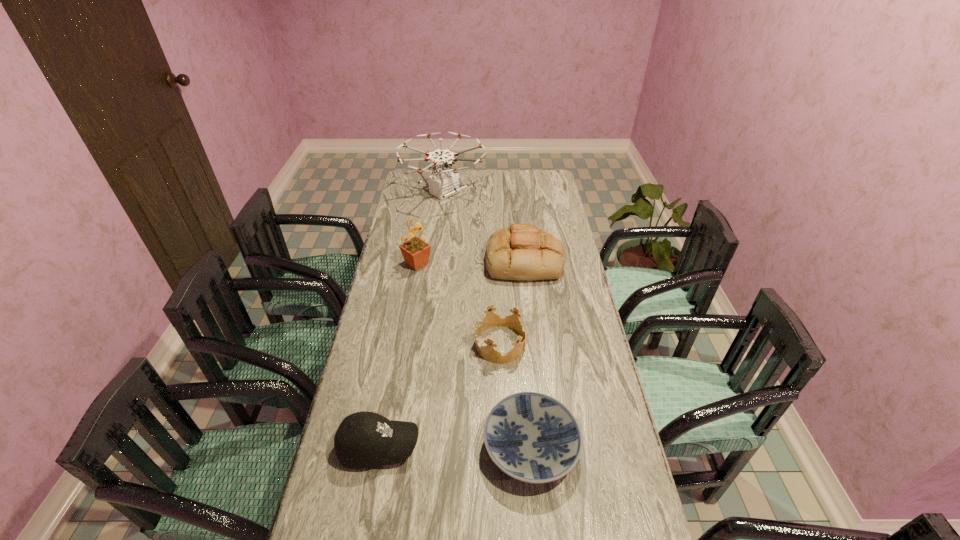
The height and width of the screenshot is (540, 960). What are the coordinates of `vacant region located 0.170m on the front-facing side of the baseball cap` in the screenshot? It's located at (483, 447).

Image resolution: width=960 pixels, height=540 pixels. Find the location of `free region located 0.380m on the front-facing side of the third nearest object`. free region located 0.380m on the front-facing side of the third nearest object is located at coordinates (362, 344).

Find the location of a particular element. This screenshot has height=540, width=960. free spot located on the front-facing side of the third nearest object is located at coordinates (430, 344).

Find the location of a particular element. Image resolution: width=960 pixels, height=540 pixels. free space located 0.260m on the front-facing side of the third nearest object is located at coordinates (397, 344).

Identify the location of free space located 0.360m on the left of the shortest object. (351, 447).

The image size is (960, 540). Find the location of `object present at the far edge`. object present at the far edge is located at coordinates (444, 182).

The width and height of the screenshot is (960, 540). Find the location of `drone that is at the left edge`. drone that is at the left edge is located at coordinates (444, 182).

Locate an element on the screen. This screenshot has height=540, width=960. sunflower located in the left edge section of the desktop is located at coordinates (415, 251).

At what (x,y) coordinates should I click in order to perform the action: click on baseball cap present at the left edge. Please return your answer as a coordinate pair (x, y). This screenshot has width=960, height=540. Looking at the image, I should click on (363, 439).

Identify the location of bread that is positioned at the right edge. The width and height of the screenshot is (960, 540). (522, 252).